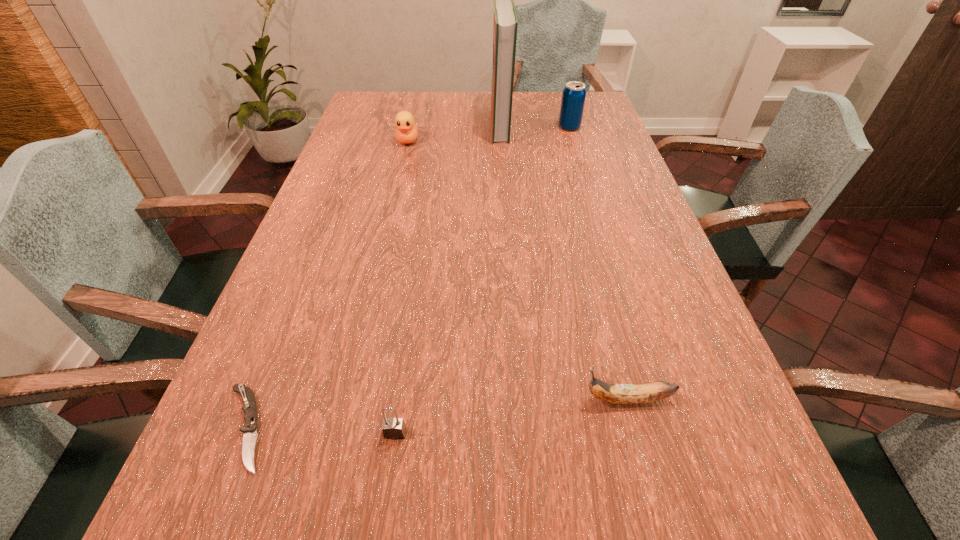
You are a GUI agent. You are given a task and a screenshot of the screen. Output one action in this format:
    pyautogui.click(x=<x>, y=<y>)
    Task: Click on the free space that is in between the pocketknife and the padlock
    The width and height of the screenshot is (960, 540).
    Given the screenshot: What is the action you would take?
    pyautogui.click(x=321, y=430)

You are a GUI agent. You are given a task and a screenshot of the screen. Output one action in this format:
    pyautogui.click(x=<x>, y=<y>)
    Task: Click on the blank region between the tallest object and the pop soda
    
    Given the screenshot: What is the action you would take?
    pyautogui.click(x=535, y=126)

This screenshot has height=540, width=960. I want to click on free space between the pop soda and the duckling, so click(x=489, y=134).

The height and width of the screenshot is (540, 960). Identify the location of free spot between the banana and the padlock. (511, 416).

You are a GUI agent. You are given a task and a screenshot of the screen. Output one action in this format:
    pyautogui.click(x=<x>, y=<y>)
    Task: Click on the free space that is in between the tallest object and the fifth object from right to left
    This screenshot has height=540, width=960.
    Given the screenshot: What is the action you would take?
    [x=454, y=133]

Locate an element on the screen. Image resolution: width=960 pixels, height=540 pixels. blank region between the fifth shortest object and the leftmost object is located at coordinates (407, 278).

Identify which object is located as the nearest to the banana. Please provide its 2D coordinates. Your answer should be formatted as a tuple, i.e. [(x, y)], where the tuple contains the x and y coordinates of a point satisfying the conditions above.

[(393, 428)]

The height and width of the screenshot is (540, 960). What are the coordinates of `object that is the fourth closest to the leftmost object` in the screenshot? It's located at (505, 24).

Where is `blank area in the image that satisfies the following two spatial constraints: 1. on the cover of the tallest object; 2. on the face of the duckling`? blank area in the image that satisfies the following two spatial constraints: 1. on the cover of the tallest object; 2. on the face of the duckling is located at coordinates (501, 141).

Image resolution: width=960 pixels, height=540 pixels. I want to click on vacant space that satisfies the following two spatial constraints: 1. on the cover of the hardback book; 2. on the face of the second object from left to right, so click(x=501, y=141).